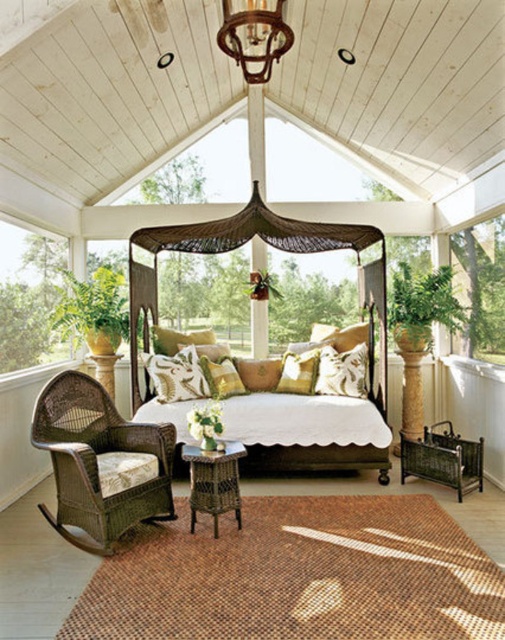
You are standing at point [101,461] in the sunroom. What object is located at this point?

The woven wicker rocking chair at lower left is located at point [101,461].